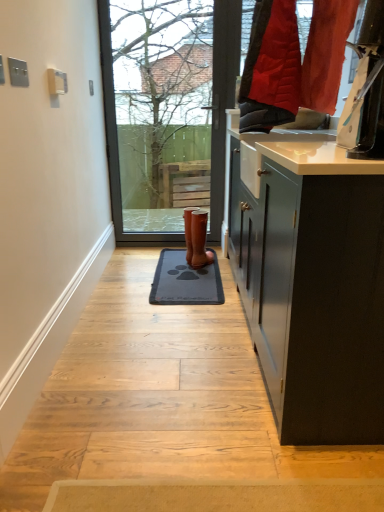
Locate an element on the screen. This screenshot has width=384, height=512. free space in front of dark gray rubber doormat at center is located at coordinates (175, 323).